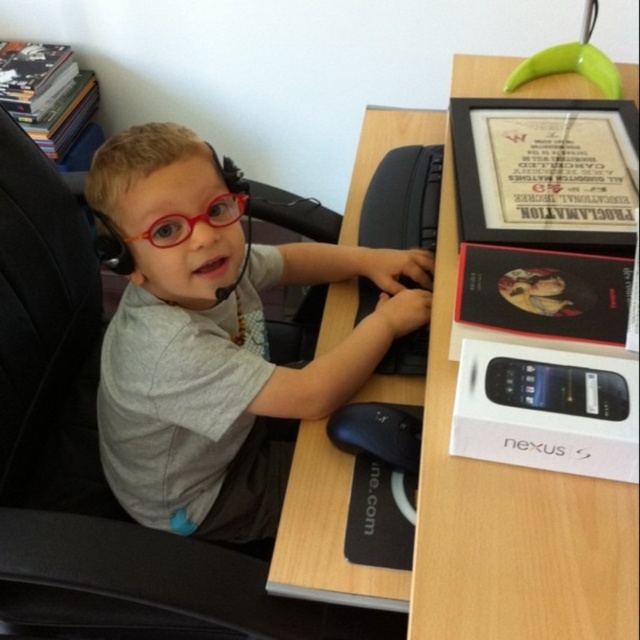
You are a visitor in the room and want to hand the child a note. The note is too big to fit on the desk, so you need to place it somewhere else. Which object between the black textured keyboard at center and the red plastic glasses at center is closer to you, so you can place the note there?

The black textured keyboard at center is closer to you than the red plastic glasses at center, so you should place the note there.